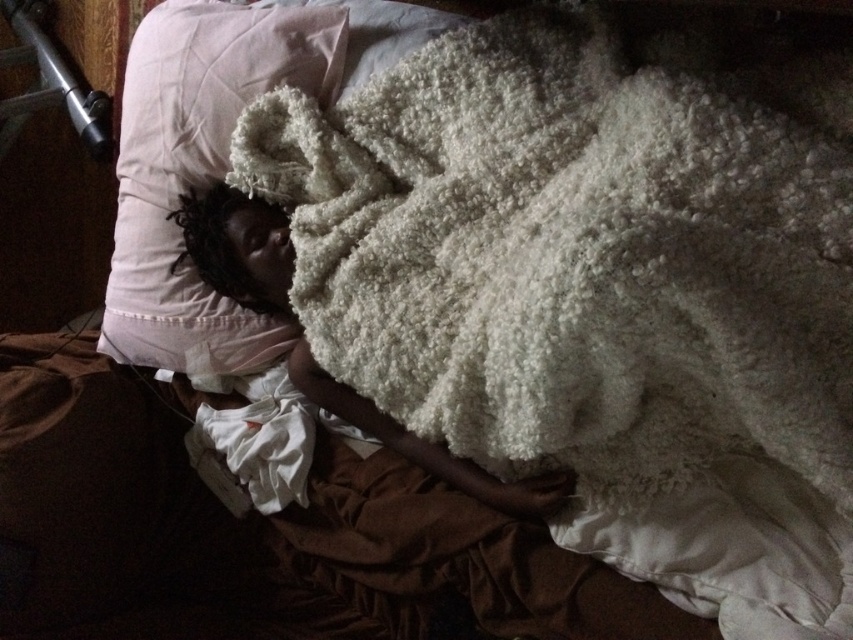
Looking at this image, you are a nurse checking on a patient in a hospital room. You need to adjust the bed to make the patient more comfortable. The bed has a headrest that can be raised. If you raise the headrest, will the white fluffy blanket at upper center and the white soft pillow at upper left move closer together or farther apart?

The white fluffy blanket at upper center and the white soft pillow at upper left are currently 13.85 inches apart. When raising the headrest, the distance between them may change depending on how the bedding shifts. However, without specific information about how the bedding moves when adjusting the bed, it is impossible to determine if they will move closer or farther apart.

You are standing at the foot of the bed in the dimly lit room. You notice two points marked on the bedspread. The first point is at coordinates point (347, 209) and the second is at point (196, 259). If you want to move from the first point to the second point along the bedspread, which direction should you move relative to the bed?

You should move towards the foot of the bed because point (347, 209) is in front of point (196, 259), meaning the second point is closer to the foot of the bed.

You are standing in the room and want to reach the point marked as point (148, 237) on the bed. If your arm can extend 1.2 meters, can you reach it without moving closer?

The distance between you and point (148, 237) is 1.30 meters, which is slightly longer than your arm extension of 1.2 meters. Therefore, you cannot reach it without moving closer.